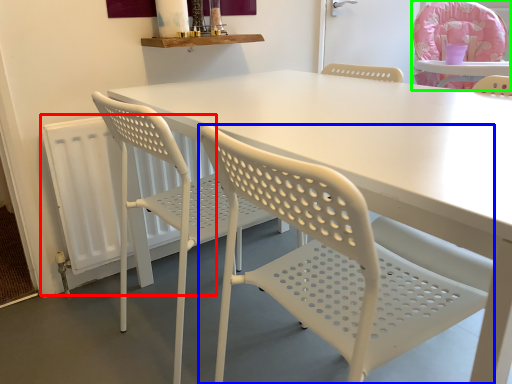
Question: Which object is positioned closest to radiator (highlighted by a red box)? Select from chair (highlighted by a blue box) and chair (highlighted by a green box).

Choices:
 (A) chair
 (B) chair

Answer: (A)